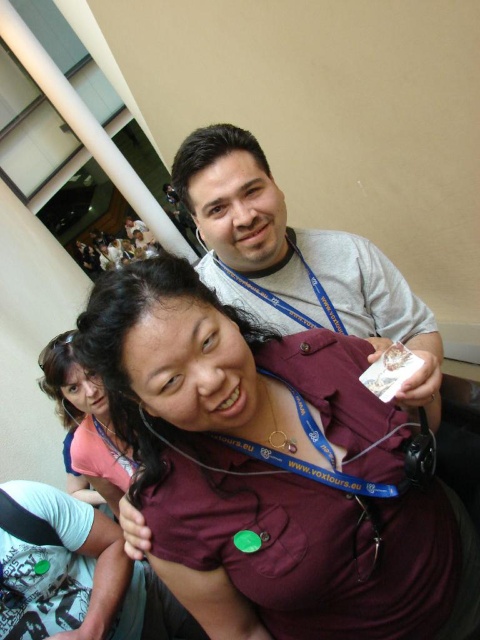
Question: Is gray fabric neck at upper center positioned before blue fabric lanyard at upper center?

Choices:
 (A) no
 (B) yes

Answer: (B)

Question: Which object is positioned closest to the matte blue shirt at center?

Choices:
 (A) matte burgundy shirt at center
 (B) blue fabric lanyard at center

Answer: (B)

Question: Which object is farther from the camera taking this photo?

Choices:
 (A) gray lanyard at upper center
 (B) blue fabric lanyard at upper center
 (C) matte blue shirt at center
 (D) blue fabric lanyard at center

Answer: (D)

Question: Does maroon fabric shirt at center lie behind gray lanyard at upper center?

Choices:
 (A) no
 (B) yes

Answer: (A)

Question: Among these objects, which one is farthest from the camera?

Choices:
 (A) gray fabric neck at upper center
 (B) matte blue shirt at center
 (C) blue fabric lanyard at center

Answer: (C)

Question: Is matte burgundy shirt at center thinner than blue fabric lanyard at center?

Choices:
 (A) yes
 (B) no

Answer: (B)